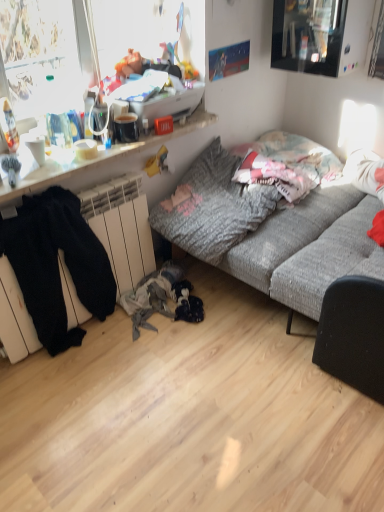
Question: Should I look upward or downward to see textured gray couch at center?

Choices:
 (A) down
 (B) up

Answer: (B)

Question: Is black cotton pants at lower left oriented towards white glossy bowl at upper left?

Choices:
 (A) no
 (B) yes

Answer: (A)

Question: From the image's perspective, does black cotton pants at lower left appear higher than white glossy bowl at upper left?

Choices:
 (A) no
 (B) yes

Answer: (A)

Question: Are black cotton pants at lower left and white glossy bowl at upper left making contact?

Choices:
 (A) yes
 (B) no

Answer: (B)

Question: Considering the relative sizes of black cotton pants at lower left and white glossy bowl at upper left in the image provided, is black cotton pants at lower left taller than white glossy bowl at upper left?

Choices:
 (A) yes
 (B) no

Answer: (A)

Question: Does black cotton pants at lower left appear on the right side of white glossy bowl at upper left?

Choices:
 (A) yes
 (B) no

Answer: (B)

Question: Is black cotton pants at lower left turned away from white glossy bowl at upper left?

Choices:
 (A) yes
 (B) no

Answer: (B)

Question: From a real-world perspective, does wooden desk at upper left stand above white glossy bowl at upper left?

Choices:
 (A) yes
 (B) no

Answer: (B)

Question: Can you confirm if wooden desk at upper left is positioned to the right of white glossy bowl at upper left?

Choices:
 (A) no
 (B) yes

Answer: (B)

Question: Would you consider wooden desk at upper left to be distant from white glossy bowl at upper left?

Choices:
 (A) yes
 (B) no

Answer: (B)

Question: From the image's perspective, does wooden desk at upper left appear lower than white glossy bowl at upper left?

Choices:
 (A) yes
 (B) no

Answer: (B)

Question: Is wooden desk at upper left further to the viewer compared to white glossy bowl at upper left?

Choices:
 (A) no
 (B) yes

Answer: (A)

Question: Is wooden desk at upper left positioned with its back to white glossy bowl at upper left?

Choices:
 (A) no
 (B) yes

Answer: (A)

Question: Is black cotton pants at lower left at the back of textured gray couch at center?

Choices:
 (A) yes
 (B) no

Answer: (B)